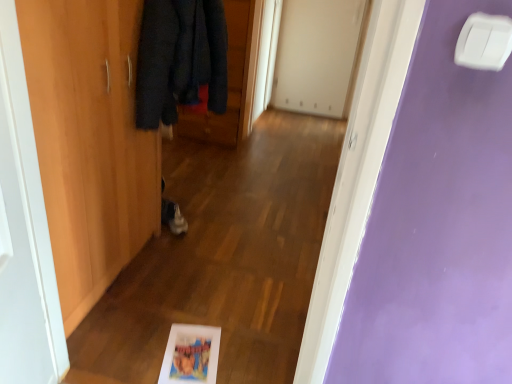
This screenshot has width=512, height=384. Find the location of `vacant point to the right of matte plastic picture frame at lower center`. vacant point to the right of matte plastic picture frame at lower center is located at coordinates (247, 352).